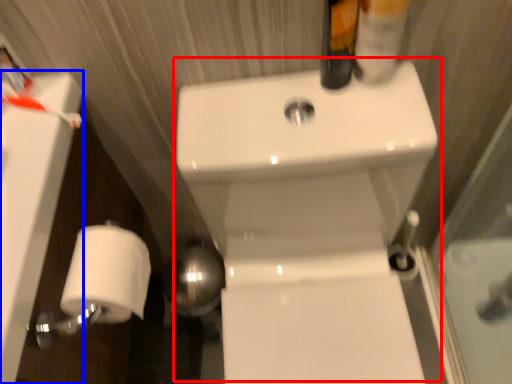
Question: Which object is closer to the camera taking this photo, sink (highlighted by a red box) or bath (highlighted by a blue box)?

Choices:
 (A) sink
 (B) bath

Answer: (A)